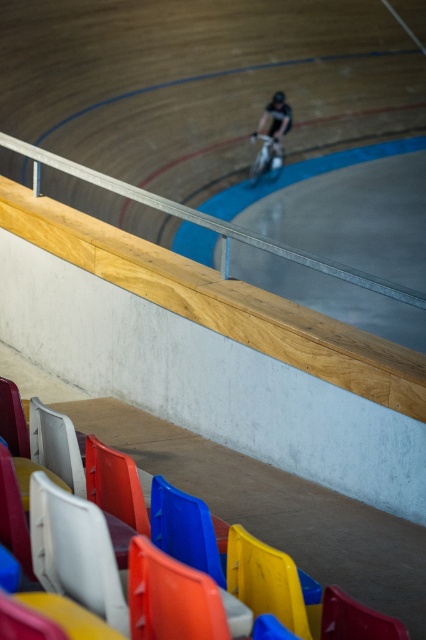
Is black matte bicycle at center further to camera compared to blue plastic chair at lower center?

Yes, it is.

Is black matte bicycle at center wider than blue plastic chair at lower center?

Yes.

Does point (268, 157) come farther from viewer compared to point (327, 593)?

Yes.

You are a GUI agent. You are given a task and a screenshot of the screen. Output one action in this format:
    pyautogui.click(x=<x>, y=<y>)
    Task: Click on the black matte bicycle at center
    This screenshot has height=640, width=426.
    Given the screenshot: What is the action you would take?
    pyautogui.click(x=271, y=138)

Is white plastic chair at lower left below black matte bicycle at center?

Yes.

Does white plastic chair at lower left have a smaller size compared to black matte bicycle at center?

Yes.

Image resolution: width=426 pixels, height=640 pixels. I want to click on white plastic chair at lower left, so click(74, 552).

Is point (40, 540) farther from camera compared to point (373, 618)?

Yes, point (40, 540) is farther from viewer.

How much distance is there between white plastic chair at lower left and blue plastic chair at lower center?

white plastic chair at lower left is 31.72 inches away from blue plastic chair at lower center.

Between point (118, 602) and point (347, 596), which one is positioned in front?

Point (347, 596) is in front.

Locate an element on the screen. This screenshot has height=640, width=426. white plastic chair at lower left is located at coordinates (74, 552).